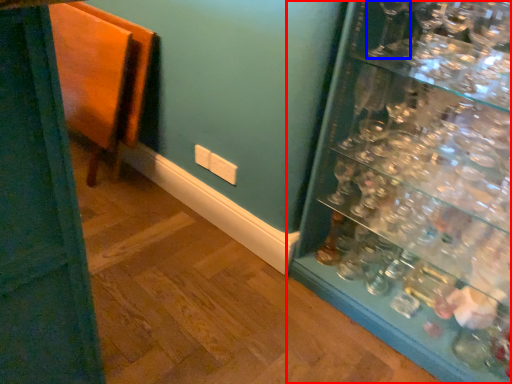
Question: Which point is further to the camera, shelf (highlighted by a red box) or wine glass (highlighted by a blue box)?

Choices:
 (A) shelf
 (B) wine glass

Answer: (B)